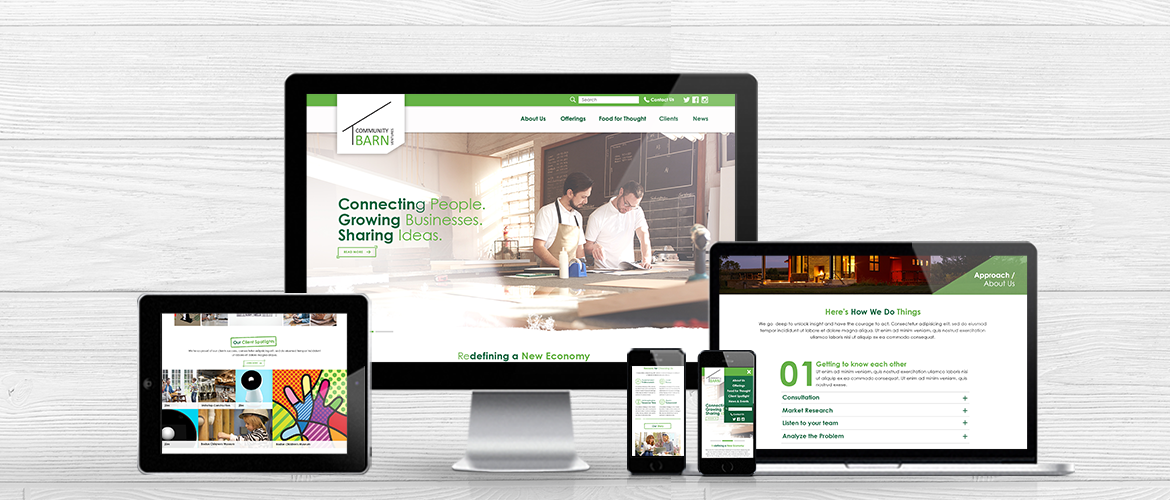
You are a GUI agent. You are given a task and a screenshot of the screen. Output one action in this format:
    pyautogui.click(x=<x>, y=<y>)
    Task: Click on the monitor screen
    
    Given the screenshot: What is the action you would take?
    pyautogui.click(x=498, y=193)